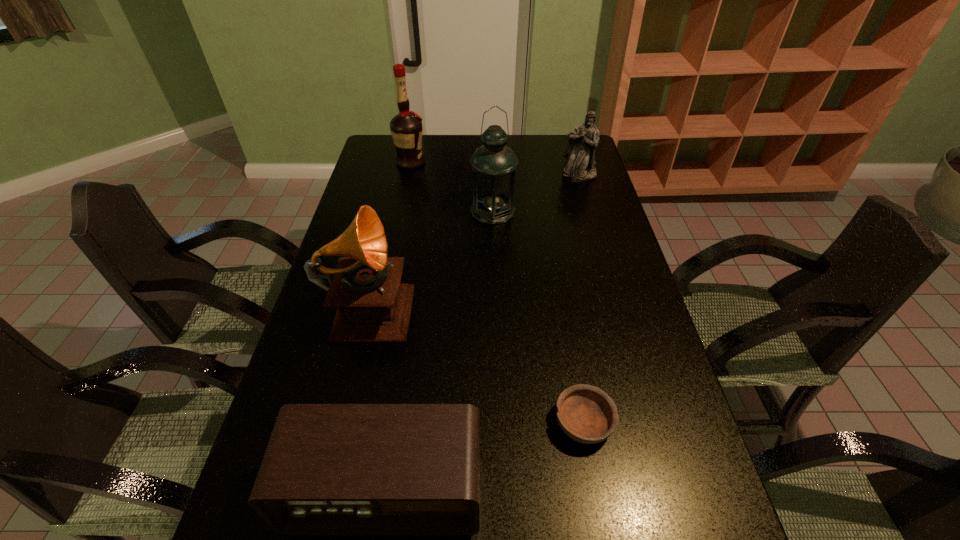
This screenshot has width=960, height=540. What are the coordinates of `free space located 0.090m on the right of the third farthest object` in the screenshot? It's located at (541, 211).

I want to click on vacant space positioned 0.400m on the horn of the fourth farthest object, so point(557,303).

Where is `blank area located on the front-facing side of the figurine`? blank area located on the front-facing side of the figurine is located at coordinates (584, 191).

Locate an element on the screen. The width and height of the screenshot is (960, 540). blank space located 0.070m on the back of the fifth farthest object is located at coordinates (574, 370).

The image size is (960, 540). I want to click on object that is at the far edge, so click(406, 128).

In order to click on liquor situated at the left edge in this screenshot , I will do `click(406, 128)`.

Where is `phonograph record located at the left edge`? phonograph record located at the left edge is located at coordinates (373, 307).

Locate an element on the screen. Image resolution: width=960 pixels, height=540 pixels. radio receiver that is at the left edge is located at coordinates (329, 469).

Locate an element on the screen. The width and height of the screenshot is (960, 540). figurine that is at the right edge is located at coordinates (580, 165).

Where is `bowl at the right edge`? bowl at the right edge is located at coordinates (585, 413).